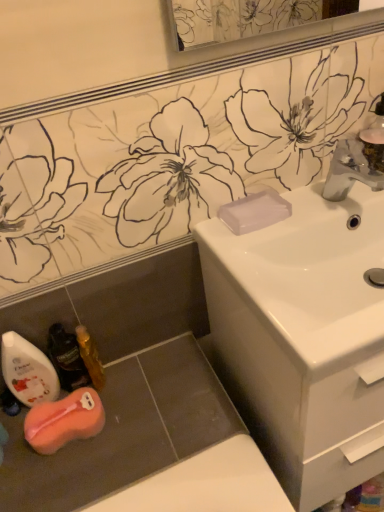
Question: Considering the relative sizes of white glossy sink at center and transparent plastic soap at sink right in the image provided, is white glossy sink at center wider than transparent plastic soap at sink right?

Choices:
 (A) yes
 (B) no

Answer: (A)

Question: Is there a large distance between white glossy sink at center and transparent plastic soap at sink right?

Choices:
 (A) no
 (B) yes

Answer: (A)

Question: From the image's perspective, would you say white glossy sink at center is positioned over transparent plastic soap at sink right?

Choices:
 (A) yes
 (B) no

Answer: (B)

Question: Does white glossy sink at center touch transparent plastic soap at sink right?

Choices:
 (A) no
 (B) yes

Answer: (A)

Question: Is transparent plastic soap at sink right at the back of white glossy sink at center?

Choices:
 (A) no
 (B) yes

Answer: (A)

Question: Does white glossy sink at center appear on the right side of transparent plastic soap at sink right?

Choices:
 (A) yes
 (B) no

Answer: (A)

Question: From a real-world perspective, is white glossy mouthwash at lower left, the third mouthwash positioned from the right, located higher than transparent plastic soap at sink right?

Choices:
 (A) no
 (B) yes

Answer: (A)

Question: Is white glossy mouthwash at lower left, the third mouthwash positioned from the right, facing away from transparent plastic soap at sink right?

Choices:
 (A) yes
 (B) no

Answer: (B)

Question: Is transparent plastic soap at sink right located within white glossy mouthwash at lower left, the 1th mouthwash positioned from the left?

Choices:
 (A) yes
 (B) no

Answer: (B)

Question: Is white glossy mouthwash at lower left, the third mouthwash positioned from the right, taller than transparent plastic soap at sink right?

Choices:
 (A) no
 (B) yes

Answer: (B)

Question: Is the position of white glossy mouthwash at lower left, the third mouthwash positioned from the right, more distant than that of transparent plastic soap at sink right?

Choices:
 (A) no
 (B) yes

Answer: (A)

Question: Is white glossy mouthwash at lower left, the 1th mouthwash positioned from the left, thinner than transparent plastic soap at sink right?

Choices:
 (A) no
 (B) yes

Answer: (B)

Question: Does satin nickel faucet at upper right have a greater height compared to white glossy sink at center?

Choices:
 (A) yes
 (B) no

Answer: (B)